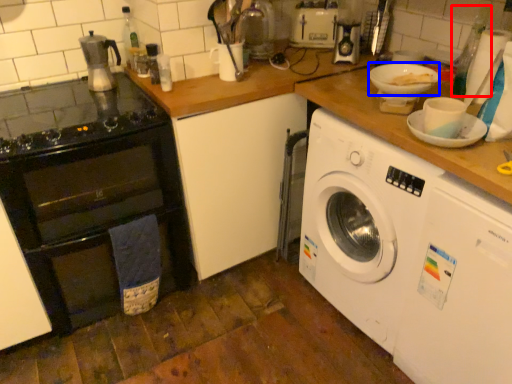
Question: Which of the following is the closest to the observer, bottle (highlighted by a red box) or basin (highlighted by a blue box)?

Choices:
 (A) bottle
 (B) basin

Answer: (B)